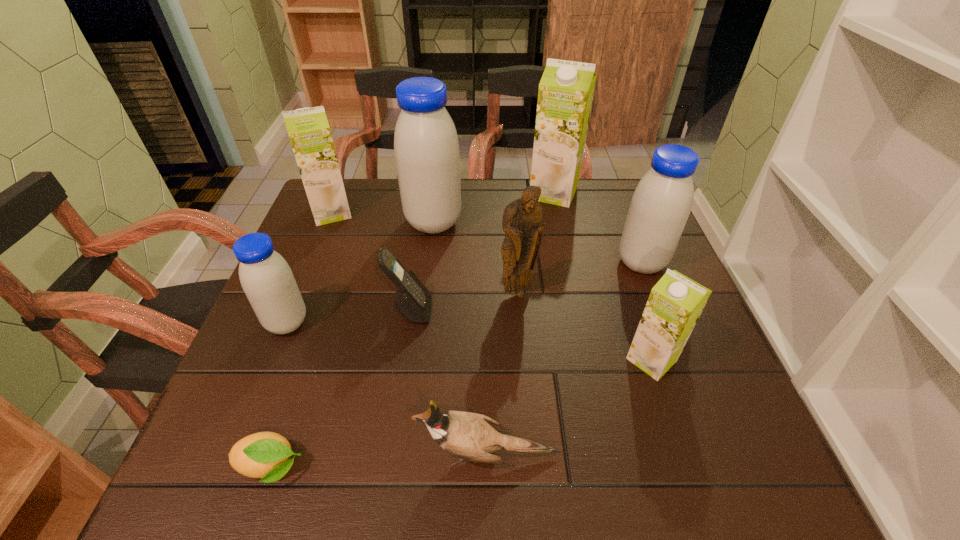
What are the coordinates of `vacant region located 0.140m on the front of the smallest green soya milk` in the screenshot? It's located at (683, 453).

Find the location of `free space located 0.330m on the front-facing side of the cellular telephone`. free space located 0.330m on the front-facing side of the cellular telephone is located at coordinates (580, 310).

I want to click on vacant region located 0.160m at the face of the bird, so click(324, 454).

Image resolution: width=960 pixels, height=540 pixels. I want to click on free space located at the face of the bird, so click(x=242, y=454).

You are a GUI agent. You are given a task and a screenshot of the screen. Output one action in this format:
    pyautogui.click(x=<x>, y=<y>)
    Task: Click on the vacant space located at the face of the bird
    The image size is (960, 540).
    Given the screenshot: What is the action you would take?
    pyautogui.click(x=295, y=454)

Find the location of a particular element. The width and height of the screenshot is (960, 540). vacant area situated 0.360m with leaves positioned above the yellow lemon is located at coordinates (523, 467).

The height and width of the screenshot is (540, 960). I want to click on bird present at the near edge, so click(469, 436).

Locate an element on the screen. The image size is (960, 540). lemon that is at the near edge is located at coordinates (266, 455).

Image resolution: width=960 pixels, height=540 pixels. In order to click on lemon present at the left edge in this screenshot , I will do (x=266, y=455).

The width and height of the screenshot is (960, 540). What are the coordinates of `object that is at the far left corner` in the screenshot? It's located at (308, 129).